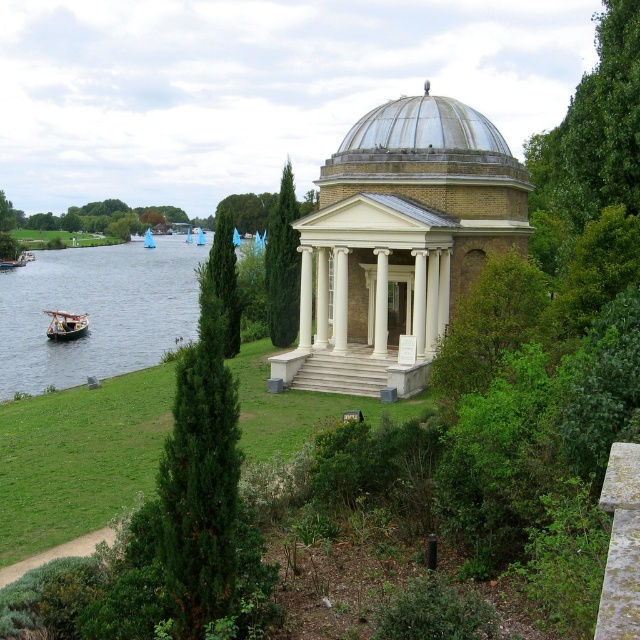
Question: Can you confirm if wooden polished boat at lower left is thinner than blue plastic sailboat at left?

Choices:
 (A) no
 (B) yes

Answer: (A)

Question: Which point is closer to the camera taking this photo?

Choices:
 (A) (448, 125)
 (B) (202, 236)
 (C) (292, 298)

Answer: (A)

Question: Which of the following is the farthest from the observer?

Choices:
 (A) (198, 230)
 (B) (173, 317)
 (C) (225, 317)

Answer: (A)

Question: Can you confirm if white stone gazebo at center is bigger than transparent glass dome at center?

Choices:
 (A) no
 (B) yes

Answer: (B)

Question: Is white stone gazebo at center to the right of wooden polished boat at lower left from the viewer's perspective?

Choices:
 (A) no
 (B) yes

Answer: (B)

Question: Which point is farther to the camera?

Choices:
 (A) wooden polished boat at lower left
 (B) white stone gazebo at center

Answer: (A)